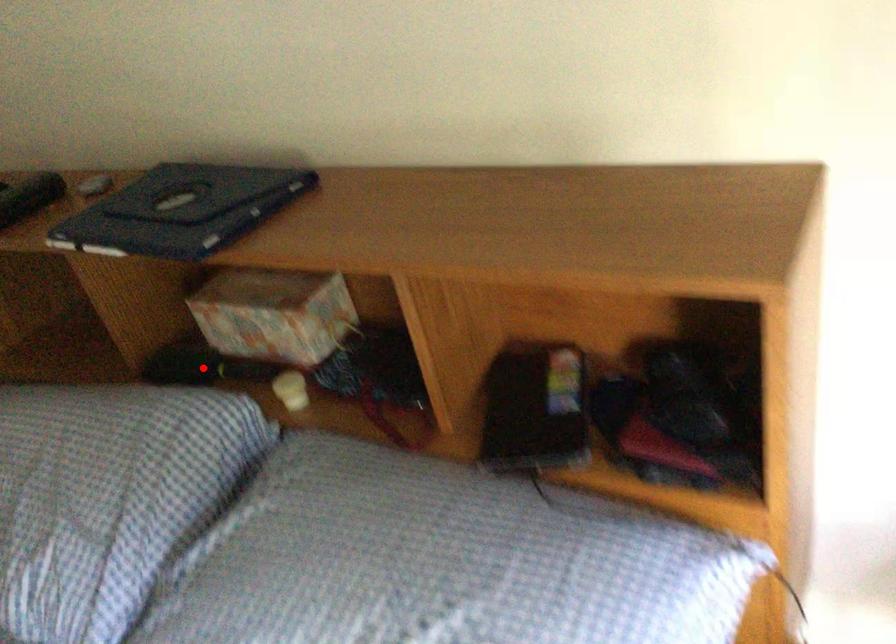
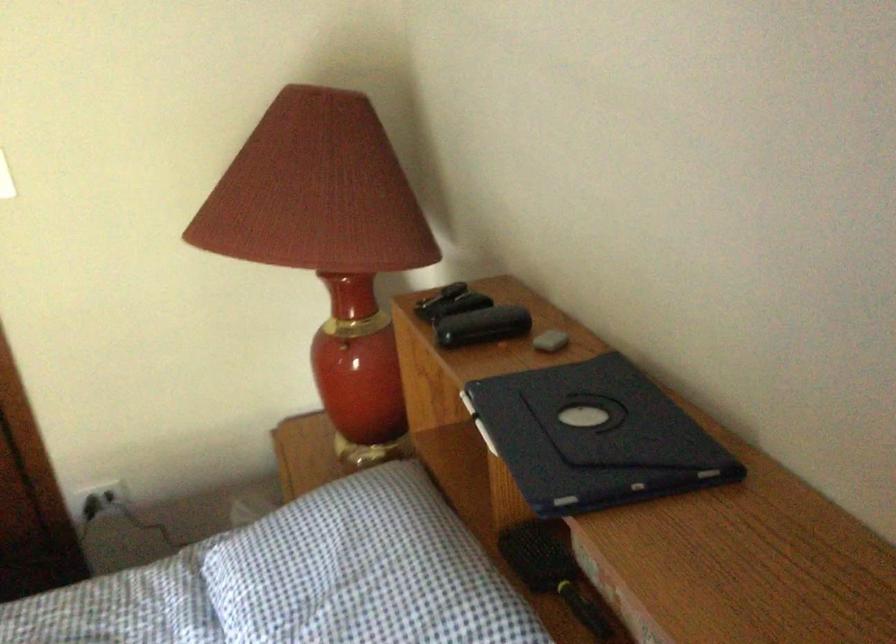
In the second image, find the point that corresponds to the highlighted location in the first image.

(552, 571)